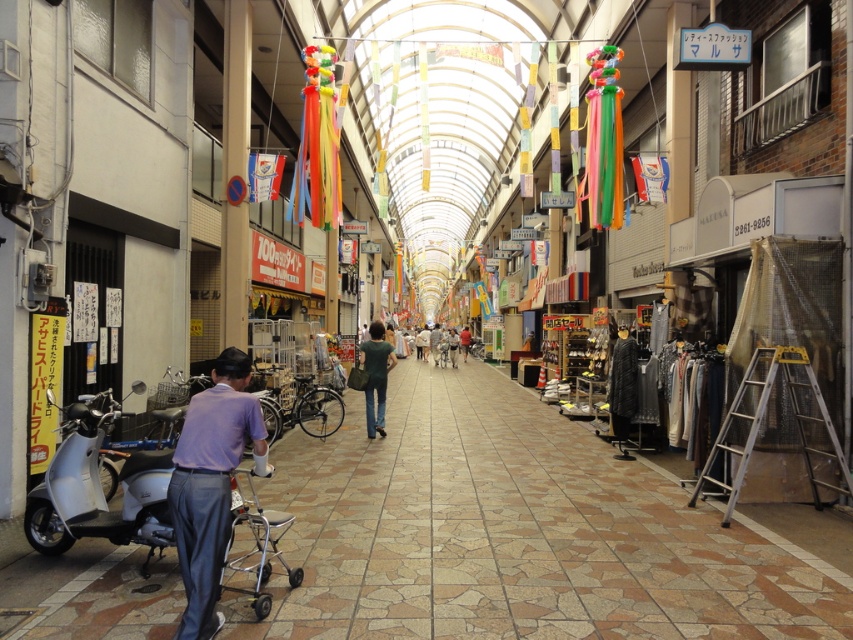
Who is positioned more to the right, white matte motorcycle at lower left or purple fabric shirt at left?

From the viewer's perspective, purple fabric shirt at left appears more on the right side.

Does white matte motorcycle at lower left have a larger size compared to purple fabric shirt at left?

Indeed, white matte motorcycle at lower left has a larger size compared to purple fabric shirt at left.

The height and width of the screenshot is (640, 853). I want to click on white matte motorcycle at lower left, so click(x=97, y=490).

Is point (378, 497) positioned in front of point (225, 566)?

No, it is behind (225, 566).

Between metallic scooter at lower left and silver metallic walker at lower left, which one has less height?

metallic scooter at lower left

Who is more distant from viewer, (585, 438) or (234, 525)?

Positioned behind is point (585, 438).

The height and width of the screenshot is (640, 853). I want to click on metallic scooter at lower left, so click(511, 532).

Which is above, silver metallic walker at lower left or dark green fabric shirt at center?

dark green fabric shirt at center

Measure the distance between point (258, 561) and camera.

Point (258, 561) is 5.35 meters from camera.

Image resolution: width=853 pixels, height=640 pixels. In order to click on silver metallic walker at lower left in this screenshot , I will do `click(258, 541)`.

At what (x,y) coordinates should I click in order to perform the action: click on silver metallic walker at lower left. Please return your answer as a coordinate pair (x, y). The width and height of the screenshot is (853, 640). Looking at the image, I should click on (258, 541).